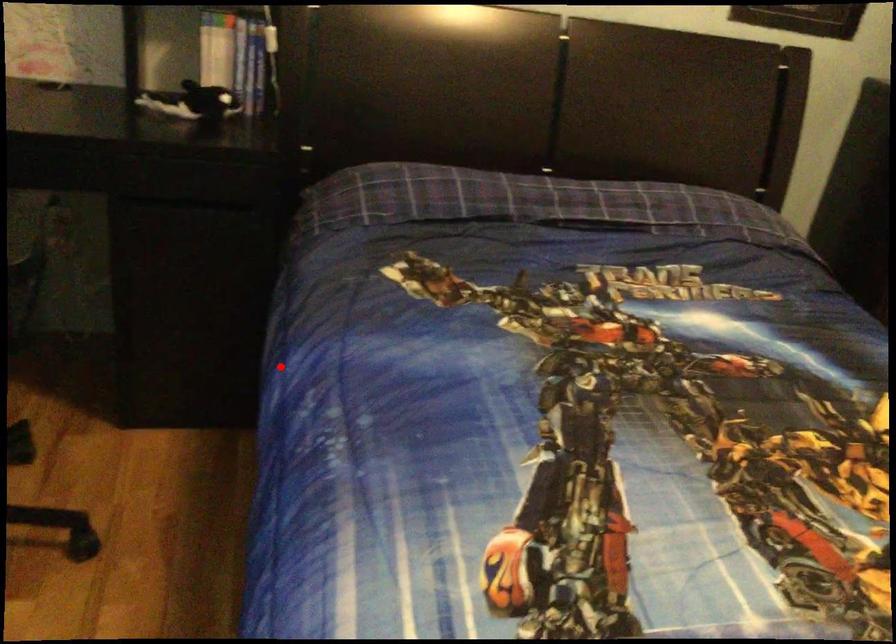
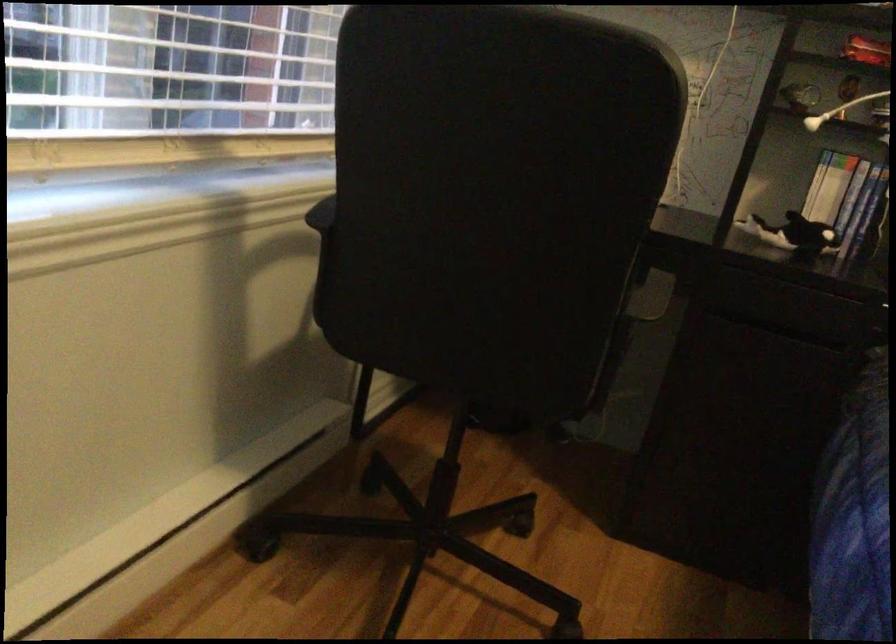
In the second image, find the point that corresponds to the highlighted location in the first image.

(853, 518)